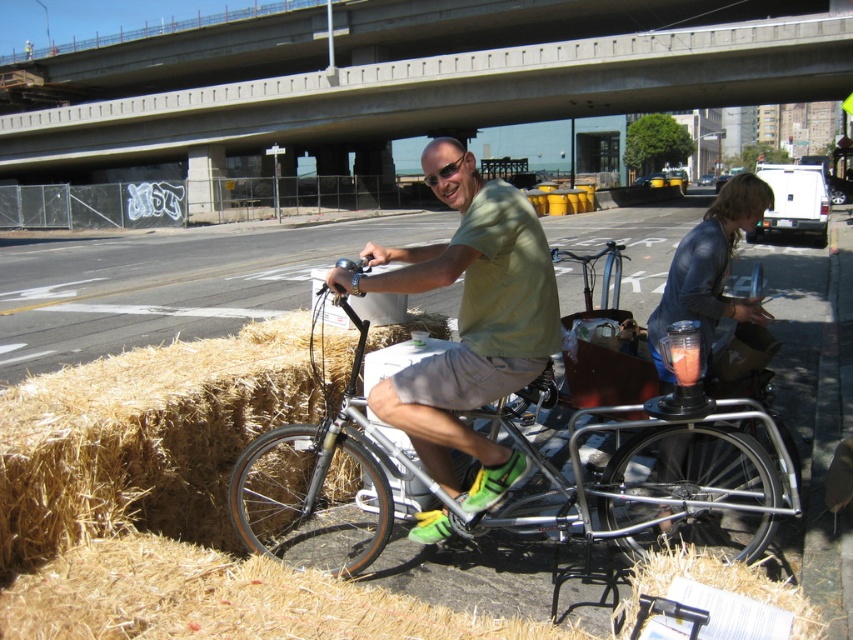
You are a delivery person who needs to place a package on the brown hay bales at lower left. However, there is a translucent plastic cup at center in the way. Can you move the cup to make space without disturbing the hay bales?

The brown hay bales at lower left might be wider than the translucent plastic cup at center, so moving the cup could create enough space for the package without needing to disturb the hay bales.

What is the coordinate of the concrete at upper center?

The coordinate of the concrete at upper center is at point [421,81].

What is located at the coordinate point (x=421, y=81) in the image?

Concrete at upper center is located at the coordinate point (x=421, y=81).